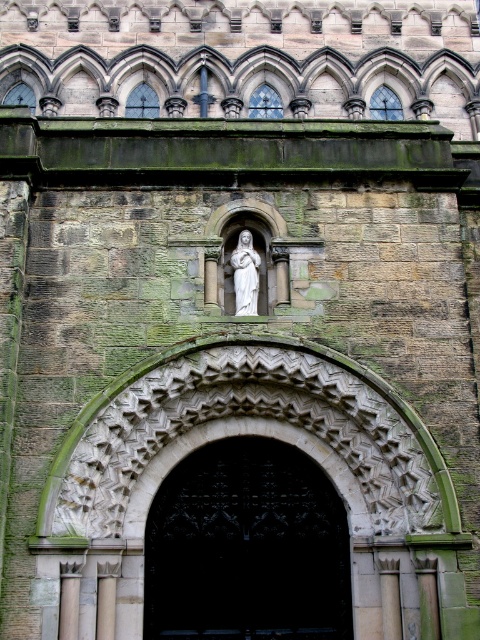
Is black wrought iron gate at center closer to the viewer compared to white marble statue at center?

Yes.

Which is in front, point (264, 552) or point (243, 268)?

Point (264, 552)

The height and width of the screenshot is (640, 480). I want to click on black wrought iron gate at center, so click(x=247, y=547).